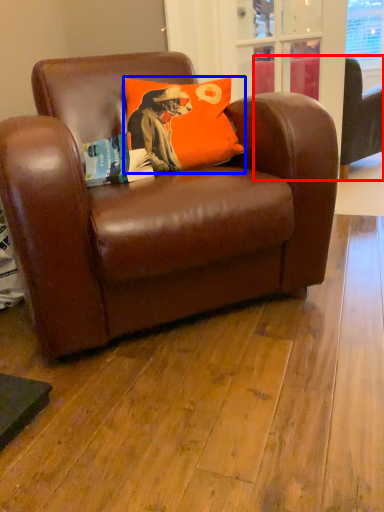
Question: Which of the following is the closest to the observer, studio couch (highlighted by a red box) or pillow (highlighted by a blue box)?

Choices:
 (A) studio couch
 (B) pillow

Answer: (B)